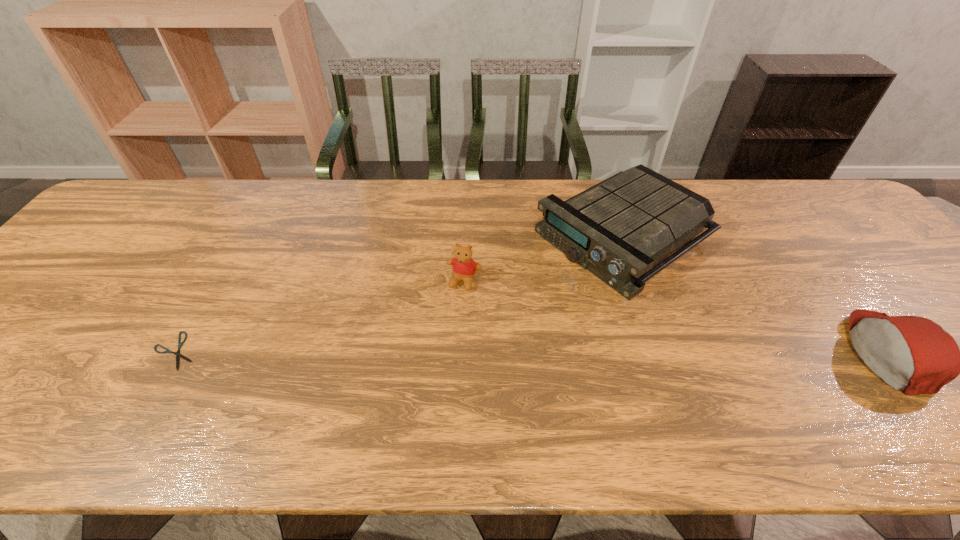
Find the location of a particular element. Image resolution: width=960 pixels, height=540 pixels. unoccupied position between the teddy bear and the radio receiver is located at coordinates (544, 258).

This screenshot has width=960, height=540. What are the coordinates of `free space between the teddy bear and the radio receiver` in the screenshot? It's located at (544, 258).

Image resolution: width=960 pixels, height=540 pixels. I want to click on free point between the second object from right to left and the shears, so click(399, 293).

Identify the location of free space between the shears and the third object from left to right. (399, 293).

Locate which object is the second closest to the teddy bear. Please provide its 2D coordinates. Your answer should be formatted as a tuple, i.e. [(x, y)], where the tuple contains the x and y coordinates of a point satisfying the conditions above.

[(180, 344)]

Find the location of `the third closest object to the cap`. the third closest object to the cap is located at coordinates (180, 344).